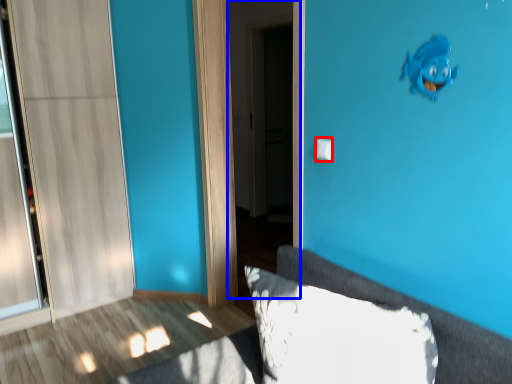
Question: Which object appears closest to the camera in this image, light switch (highlighted by a red box) or screen door (highlighted by a blue box)?

Choices:
 (A) light switch
 (B) screen door

Answer: (A)